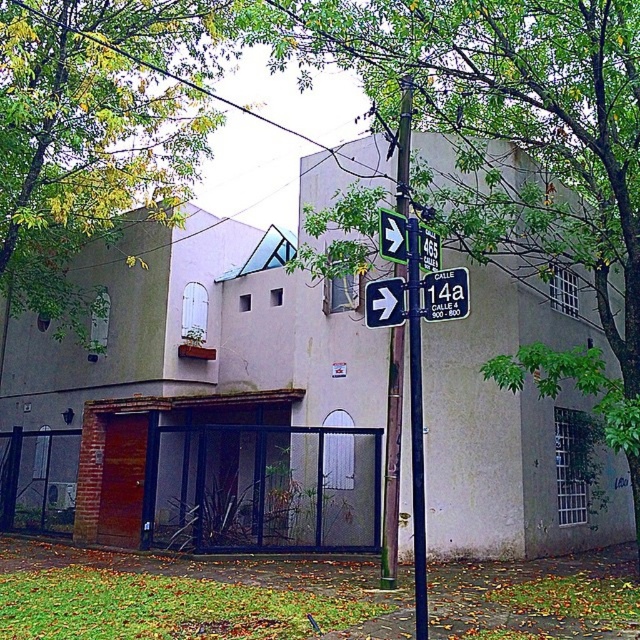
Question: Which point is farther to the camera?

Choices:
 (A) (376, 324)
 (B) (417, 246)

Answer: (A)

Question: Based on their relative distances, which object is farther from the white plastic sign at center?

Choices:
 (A) green painted metal pole at center
 (B) green leafy tree at upper left
 (C) black plastic arrow at upper center

Answer: (B)

Question: From the image, what is the correct spatial relationship of green painted metal pole at center in relation to white plastic sign at center?

Choices:
 (A) below
 (B) above

Answer: (A)

Question: Does green leafy tree at center have a smaller size compared to white plastic sign at center?

Choices:
 (A) no
 (B) yes

Answer: (B)

Question: Does white plastic sign at center have a smaller size compared to black plastic arrow at upper center?

Choices:
 (A) yes
 (B) no

Answer: (B)

Question: Which of these objects is positioned farthest from the black plastic arrow at upper center?

Choices:
 (A) white plastic sign at center
 (B) green painted metal pole at center

Answer: (B)